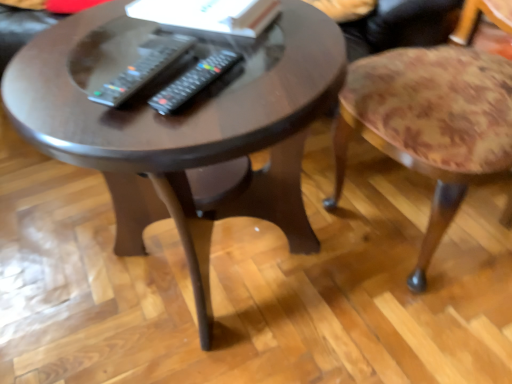
Question: Is dark wood coffee table at center behind black plastic remote at center, acting as the 1th remote starting from the right?

Choices:
 (A) no
 (B) yes

Answer: (A)

Question: Is dark wood coffee table at center to the left of black plastic remote at center, acting as the 1th remote starting from the right, from the viewer's perspective?

Choices:
 (A) no
 (B) yes

Answer: (B)

Question: Does dark wood coffee table at center have a larger size compared to black plastic remote at center, marked as the second remote in a left-to-right arrangement?

Choices:
 (A) no
 (B) yes

Answer: (B)

Question: Is the depth of dark wood coffee table at center less than that of black plastic remote at center, acting as the 1th remote starting from the right?

Choices:
 (A) no
 (B) yes

Answer: (B)

Question: Does dark wood coffee table at center have a lesser width compared to black plastic remote at center, acting as the 1th remote starting from the right?

Choices:
 (A) no
 (B) yes

Answer: (A)

Question: Is black plastic remote at center, acting as the 1th remote starting from the right, in front of or behind floral fabric stool at right in the image?

Choices:
 (A) behind
 (B) front

Answer: (A)

Question: Is point (209, 59) positioned closer to the camera than point (448, 46)?

Choices:
 (A) closer
 (B) farther

Answer: (A)

Question: Considering the relative positions of black plastic remote at center, acting as the 1th remote starting from the right, and floral fabric stool at right in the image provided, is black plastic remote at center, acting as the 1th remote starting from the right, to the left or to the right of floral fabric stool at right?

Choices:
 (A) right
 (B) left

Answer: (B)

Question: From the image's perspective, is black plastic remote at center, marked as the second remote in a left-to-right arrangement, above or below floral fabric stool at right?

Choices:
 (A) below
 (B) above

Answer: (A)

Question: From the image's perspective, is black plastic remote at center, acting as the 1th remote starting from the right, above or below black plastic remote at center, which appears as the 1th remote when viewed from the left?

Choices:
 (A) above
 (B) below

Answer: (B)

Question: Looking at their shapes, would you say black plastic remote at center, marked as the second remote in a left-to-right arrangement, is wider or thinner than black plastic remote at center, which appears as the 1th remote when viewed from the left?

Choices:
 (A) thin
 (B) wide

Answer: (A)

Question: Based on their positions, is black plastic remote at center, acting as the 1th remote starting from the right, located to the left or right of black plastic remote at center, which appears as the 1th remote when viewed from the left?

Choices:
 (A) left
 (B) right

Answer: (B)

Question: Is black plastic remote at center, marked as the second remote in a left-to-right arrangement, inside or outside of black plastic remote at center, which ranks as the second remote in right-to-left order?

Choices:
 (A) inside
 (B) outside

Answer: (B)

Question: Looking at the image, does black plastic remote at center, acting as the 1th remote starting from the right, seem bigger or smaller compared to dark wood coffee table at center?

Choices:
 (A) big
 (B) small

Answer: (B)

Question: From the image's perspective, relative to dark wood coffee table at center, is black plastic remote at center, marked as the second remote in a left-to-right arrangement, above or below?

Choices:
 (A) below
 (B) above

Answer: (B)